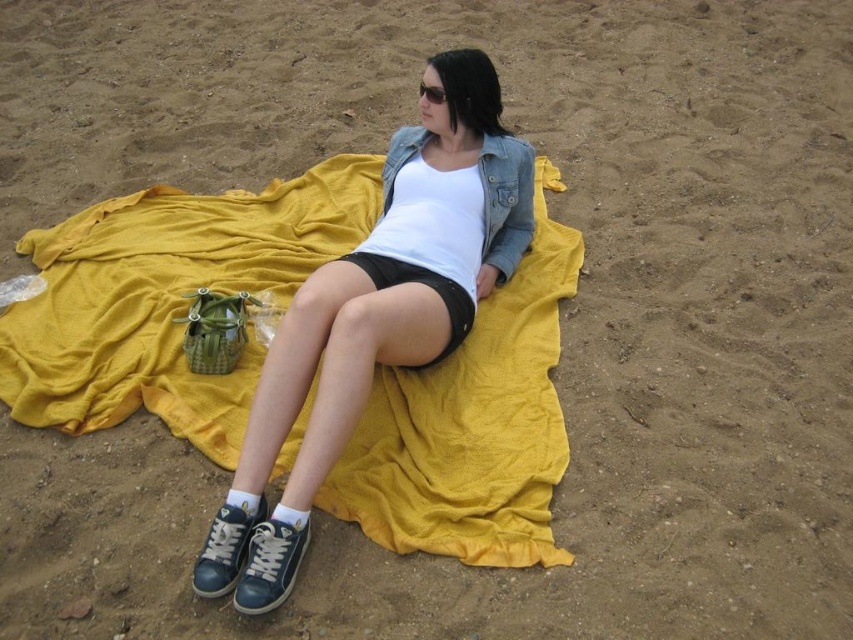
Question: Is yellow fabric blanket at center bigger than dark blue canvas sneaker at lower center?

Choices:
 (A) yes
 (B) no

Answer: (A)

Question: Which object is farther from the camera taking this photo?

Choices:
 (A) matte black shorts at center
 (B) black matte shorts at center
 (C) dark blue leather shoe at lower center
 (D) yellow fabric blanket at center

Answer: (B)

Question: Based on their relative distances, which object is nearer to the yellow fabric blanket at center?

Choices:
 (A) dark blue leather shoe at lower center
 (B) matte black shorts at center

Answer: (B)

Question: Can you confirm if dark blue canvas sneaker at lower center is thinner than dark blue leather shoe at lower center?

Choices:
 (A) no
 (B) yes

Answer: (A)

Question: Which object is positioned closest to the yellow fabric blanket at center?

Choices:
 (A) black matte shorts at center
 (B) matte black shorts at center
 (C) dark blue canvas sneaker at lower center
 (D) dark blue leather shoe at lower center

Answer: (B)

Question: Can you confirm if yellow fabric blanket at center is wider than dark blue canvas sneaker at lower center?

Choices:
 (A) no
 (B) yes

Answer: (B)